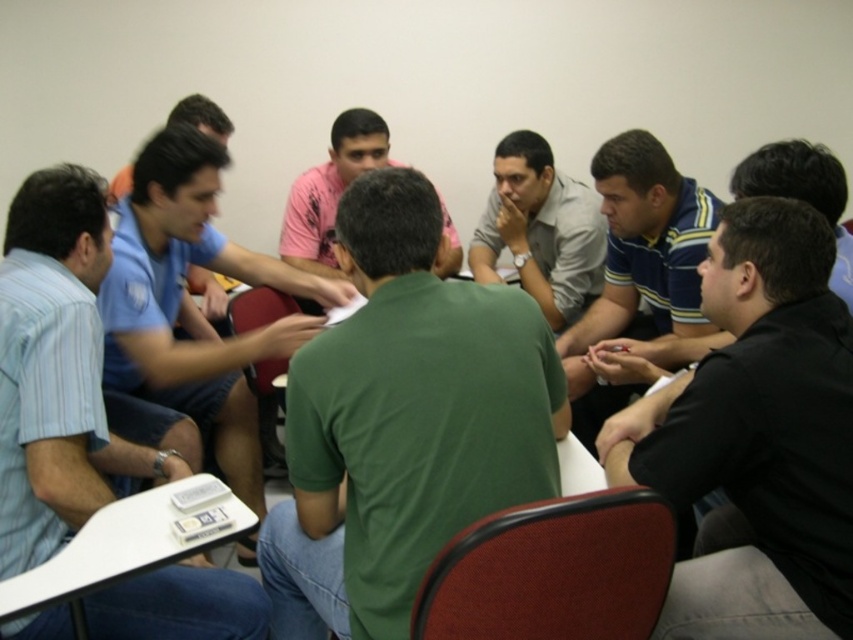
Question: Does green matte shirt at center have a lesser width compared to light blue shirt at left?

Choices:
 (A) no
 (B) yes

Answer: (A)

Question: Can you confirm if black matte shirt at lower right is bigger than blue striped shirt at center?

Choices:
 (A) yes
 (B) no

Answer: (B)

Question: Where is green matte shirt at center located in relation to black matte shirt at lower right in the image?

Choices:
 (A) right
 (B) left

Answer: (B)

Question: Based on their relative distances, which object is farther from the black matte shirt at lower right?

Choices:
 (A) gray matte shirt at center
 (B) blue shirt at center
 (C) blue striped shirt at center
 (D) green matte shirt at center

Answer: (B)

Question: Which point appears closest to the camera in this image?

Choices:
 (A) (650, 138)
 (B) (821, 605)
 (C) (529, 452)

Answer: (C)

Question: Which object is positioned closest to the blue shirt at center?

Choices:
 (A) blue striped shirt at center
 (B) pink textured shirt at center

Answer: (B)